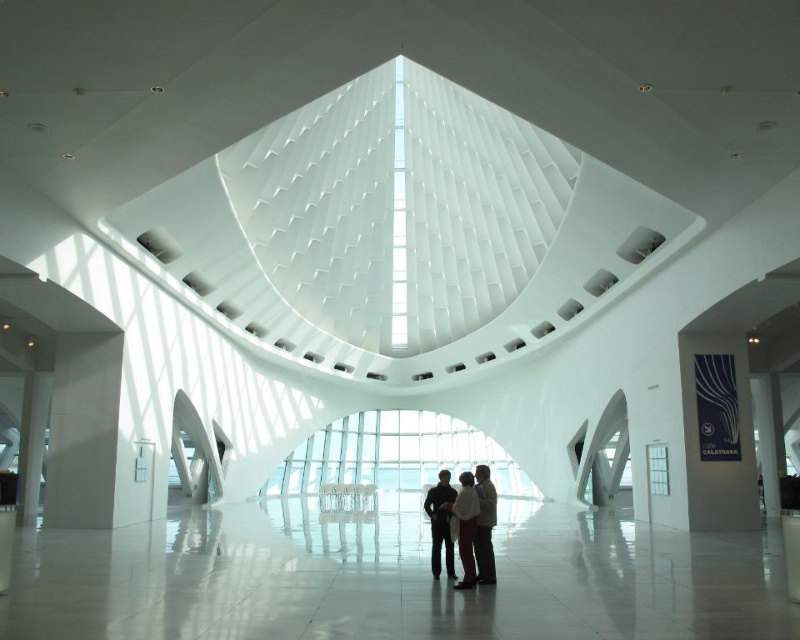
You are an event planner setting up for a fashion show in the museum. You see the dark brown leather jacket at center and the white fabric coat at center. Which item is placed on top of the other?

The dark brown leather jacket at center is positioned over white fabric coat at center, meaning it is placed on top of the coat.

You are standing in the modern museum and see both the dark blue fabric jacket at center and the white fabric coat at center. Which one is closer to you?

The dark blue fabric jacket at center is closer to you since it is 23.02 inches from the white fabric coat at center.